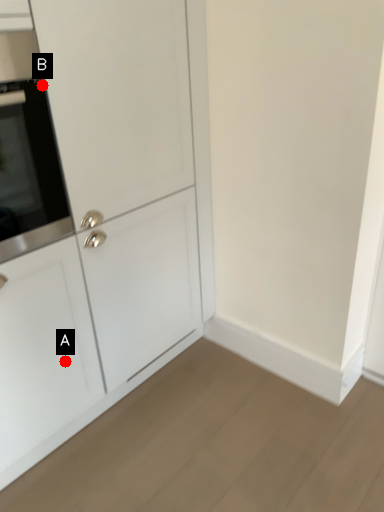
Question: Two points are circled on the image, labeled by A and B beside each circle. Which point is closer to the camera taking this photo?

Choices:
 (A) A is closer
 (B) B is closer

Answer: (B)